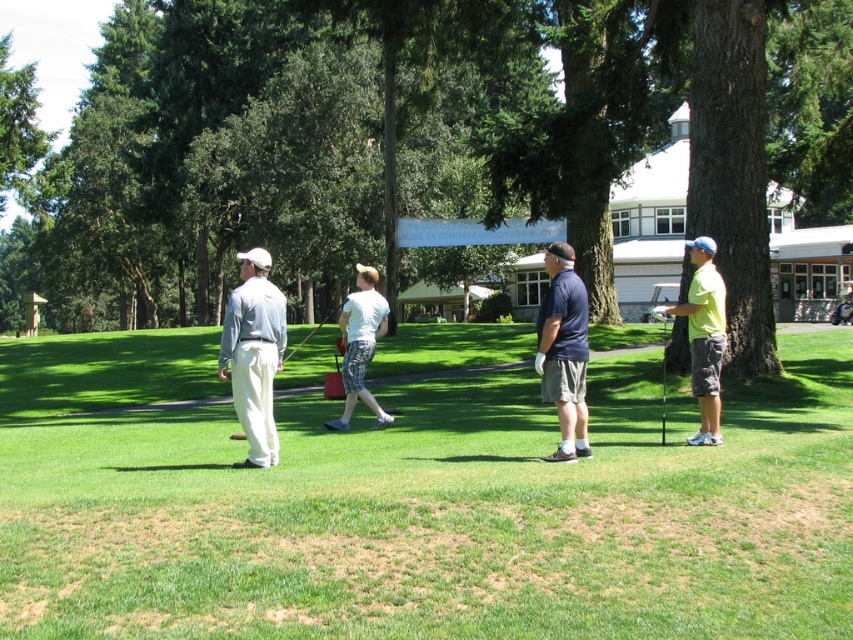
You are a golfer who wants to place your matte black golf club at center on the green grass at center. Will the club fit entirely on the grass without hanging off the edges?

The green grass at center has a larger width than the matte black golf club at center, so yes, the club will fit entirely on the grass without hanging off the edges.

You are a golfer who wants to hit the matte black golf club at center into the green grass at center. Can the club reach the grass?

The green grass at center has a lesser height compared to matte black golf club at center, so the club can reach the grass since it is taller than the grass.